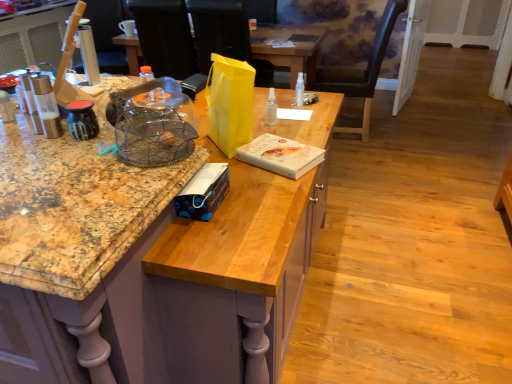
Question: Does transparent plastic bottle at center, marked as the 1th bottle in a front-to-back arrangement, appear on the right side of white matte book at center, the 1th box in the back-to-front sequence?

Choices:
 (A) no
 (B) yes

Answer: (A)

Question: From the image's perspective, is transparent plastic bottle at center, the first bottle from the left, located above white matte book at center, the first box from the right?

Choices:
 (A) no
 (B) yes

Answer: (B)

Question: Can you confirm if transparent plastic bottle at center, marked as the 1th bottle in a front-to-back arrangement, is shorter than white matte book at center, the 2th box from the left?

Choices:
 (A) no
 (B) yes

Answer: (A)

Question: Considering the relative positions of transparent plastic bottle at center, marked as the 1th bottle in a front-to-back arrangement, and white matte book at center, the 1th box in the back-to-front sequence, in the image provided, is transparent plastic bottle at center, marked as the 1th bottle in a front-to-back arrangement, behind white matte book at center, the 1th box in the back-to-front sequence,?

Choices:
 (A) no
 (B) yes

Answer: (B)

Question: Are transparent plastic bottle at center, marked as the 1th bottle in a front-to-back arrangement, and white matte book at center, the 2th box from the left, far apart?

Choices:
 (A) yes
 (B) no

Answer: (B)

Question: Is black leather chair at upper right wider or thinner than white plastic spray bottle at center, which is the 1th bottle from right to left?

Choices:
 (A) thin
 (B) wide

Answer: (B)

Question: Considering the positions of black leather chair at upper right and white plastic spray bottle at center, acting as the second bottle starting from the left, in the image, is black leather chair at upper right bigger or smaller than white plastic spray bottle at center, acting as the second bottle starting from the left,?

Choices:
 (A) big
 (B) small

Answer: (A)

Question: Would you say black leather chair at upper right is inside or outside white plastic spray bottle at center, arranged as the first bottle when viewed from the back?

Choices:
 (A) inside
 (B) outside

Answer: (B)

Question: From a real-world perspective, is black leather chair at upper right positioned above or below white plastic spray bottle at center, which is the 1th bottle from right to left?

Choices:
 (A) above
 (B) below

Answer: (B)

Question: From a real-world perspective, is matte black kettle at left, the 1th kitchen appliance when ordered from right to left, positioned above or below black matte laptop at center?

Choices:
 (A) above
 (B) below

Answer: (A)

Question: Considering the positions of matte black kettle at left, the 1th kitchen appliance when ordered from right to left, and black matte laptop at center in the image, is matte black kettle at left, the 1th kitchen appliance when ordered from right to left, taller or shorter than black matte laptop at center?

Choices:
 (A) tall
 (B) short

Answer: (A)

Question: From the image's perspective, is matte black kettle at left, the 2th kitchen appliance when ordered from left to right, above or below black matte laptop at center?

Choices:
 (A) below
 (B) above

Answer: (A)

Question: Based on their sizes in the image, would you say matte black kettle at left, the 2th kitchen appliance when ordered from left to right, is bigger or smaller than black matte laptop at center?

Choices:
 (A) big
 (B) small

Answer: (B)

Question: Is black leather chair at upper right to the left or to the right of wire mesh birdcage at center in the image?

Choices:
 (A) right
 (B) left

Answer: (A)

Question: From the image's perspective, is black leather chair at upper right positioned above or below wire mesh birdcage at center?

Choices:
 (A) below
 (B) above

Answer: (B)